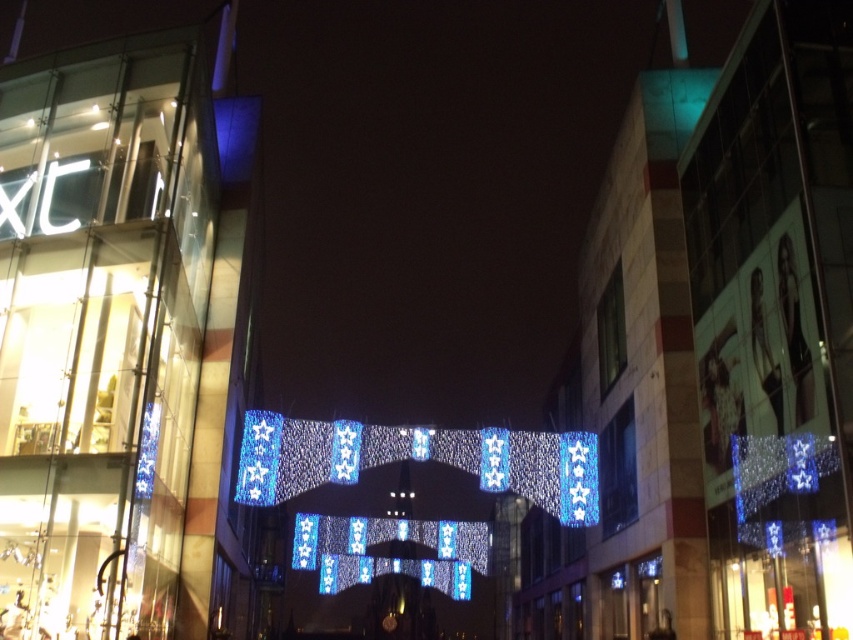
You are standing at the entrance of the XC shopping center and want to take a photo of the blue glass building at center. Where should you position yourself to ensure the building is centered in your camera frame?

To center the blue glass building at center in your camera frame, position yourself directly in front of the building at point (715, 355).

Looking at this image, you are standing on the street looking up at the nighttime scene. Which object is positioned higher between the blue glass building at center and the translucent glass mall at center?

The translucent glass mall at center is positioned higher than the blue glass building at center.

You are a delivery person trying to navigate through the city at night. You see a blue glass building at center and a translucent glass mall at center. According to the scene description, which one is located to the right of the other?

The blue glass building at center is positioned on the right side of the translucent glass mall at center, so it is to the right of the translucent glass mall at center.